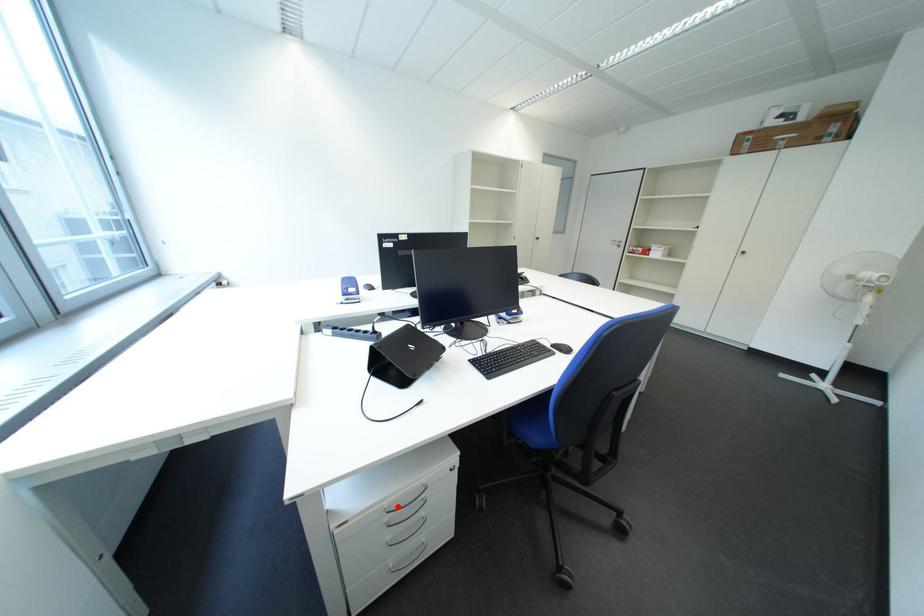
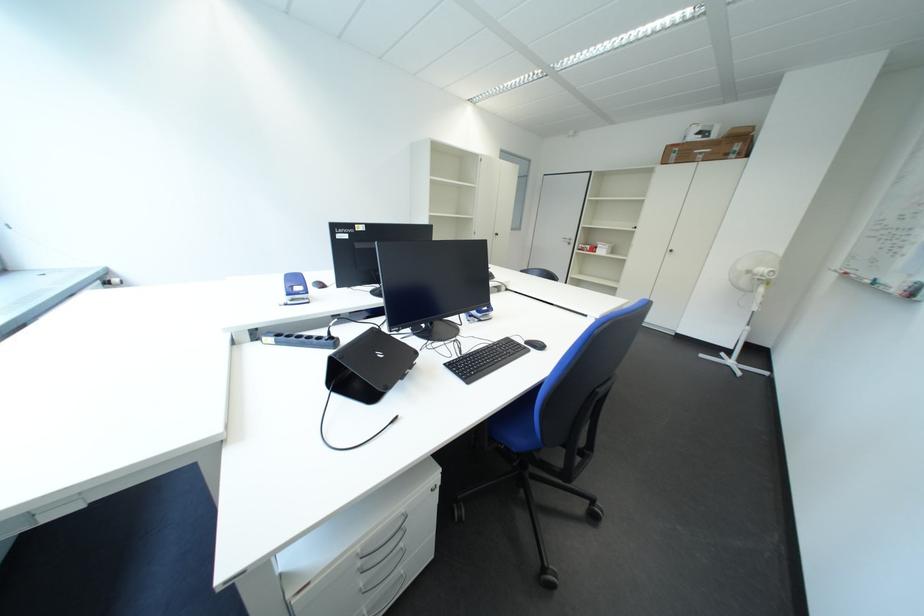
In the second image, find the point that corresponds to the highlighted location in the first image.

(371, 551)